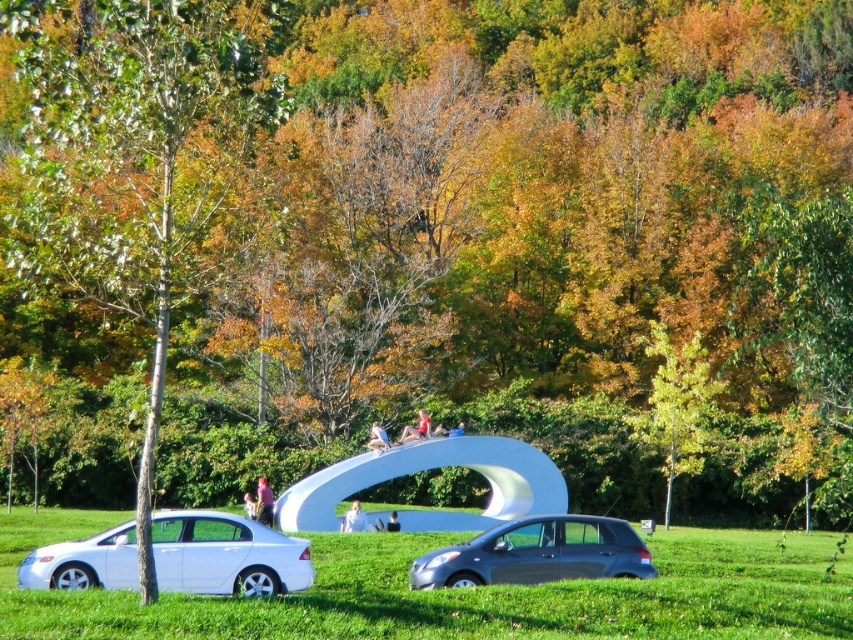
You are a photographer standing at the base of the large white curved sculpture. You want to take a photo that includes both the pink fabric shirt at center and the matte pink shirt at center. What is the minimum distance you need to move backward to ensure both shirts are in the frame?

The pink fabric shirt at center and matte pink shirt at center are 4.68 meters apart from each other. To include both in the frame, you need to move backward until you can cover this distance within your camera lens field of view. The exact distance depends on your camera and lens specifications, but generally, moving back several meters should suffice to capture both shirts in the frame.

You are a photographer wanting to capture both the green leafy tree at left and the smooth white sculpture at center in a single frame. Given their sizes, which object will occupy more space in your photo?

The green leafy tree at left is bigger than the smooth white sculpture at center, so it will occupy more space in the photo.

You are a photographer trying to capture a shot of the green leafy tree at left and the smooth white sculpture at center. From your current position, which object do you need to look upwards to see?

The green leafy tree at left is above the smooth white sculpture at center, so you need to look upwards to see the green leafy tree at left.